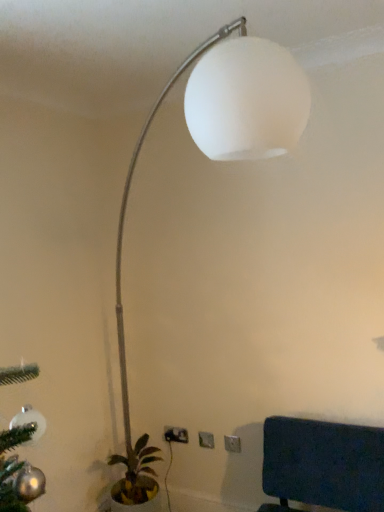
Question: Is green leafy plant in pot at lower left turned away from white plastic electric outlet at lower center, which is the 2th electric outlet in right-to-left order?

Choices:
 (A) no
 (B) yes

Answer: (A)

Question: Is green leafy plant in pot at lower left at the left side of white plastic electric outlet at lower center, the 2th electric outlet when ordered from front to back?

Choices:
 (A) no
 (B) yes

Answer: (B)

Question: Is green leafy plant in pot at lower left outside of white plastic electric outlet at lower center, the 2th electric outlet positioned from the back?

Choices:
 (A) no
 (B) yes

Answer: (B)

Question: From the image's perspective, would you say green leafy plant in pot at lower left is shown under white plastic electric outlet at lower center, which is the 2th electric outlet in right-to-left order?

Choices:
 (A) no
 (B) yes

Answer: (B)

Question: Is green leafy plant in pot at lower left thinner than white plastic electric outlet at lower center, the 2th electric outlet positioned from the back?

Choices:
 (A) yes
 (B) no

Answer: (B)

Question: Would you say green leafy plant in pot at lower left is inside or outside white plastic electric outlet at lower center, arranged as the third electric outlet when viewed from the back?

Choices:
 (A) inside
 (B) outside

Answer: (B)

Question: From the image's perspective, is green leafy plant in pot at lower left located above or below white plastic electric outlet at lower center, which is the first electric outlet in right-to-left order?

Choices:
 (A) below
 (B) above

Answer: (A)

Question: In the image, is green leafy plant in pot at lower left positioned in front of or behind white plastic electric outlet at lower center, which is the first electric outlet in right-to-left order?

Choices:
 (A) behind
 (B) front

Answer: (B)

Question: Is green leafy plant in pot at lower left taller or shorter than white plastic electric outlet at lower center, arranged as the third electric outlet when viewed from the back?

Choices:
 (A) tall
 (B) short

Answer: (A)

Question: Visually, is white plastic electric outlet at lower center, which is the first electric outlet in right-to-left order, positioned to the left or to the right of white matte lamp at upper center?

Choices:
 (A) right
 (B) left

Answer: (A)

Question: Is white plastic electric outlet at lower center, which is the first electric outlet in right-to-left order, bigger or smaller than white matte lamp at upper center?

Choices:
 (A) small
 (B) big

Answer: (A)

Question: From the image's perspective, relative to white matte lamp at upper center, is white plastic electric outlet at lower center, the third electric outlet positioned from the left, above or below?

Choices:
 (A) above
 (B) below

Answer: (B)

Question: In terms of width, does white plastic electric outlet at lower center, arranged as the third electric outlet when viewed from the back, look wider or thinner when compared to white matte lamp at upper center?

Choices:
 (A) thin
 (B) wide

Answer: (A)

Question: Is white matte lamp at upper center wider or thinner than white plastic electric outlet at lower center, the third electric outlet positioned from the left?

Choices:
 (A) thin
 (B) wide

Answer: (B)

Question: Considering the positions of point (124, 346) and point (226, 441), is point (124, 346) closer or farther from the camera than point (226, 441)?

Choices:
 (A) closer
 (B) farther

Answer: (B)